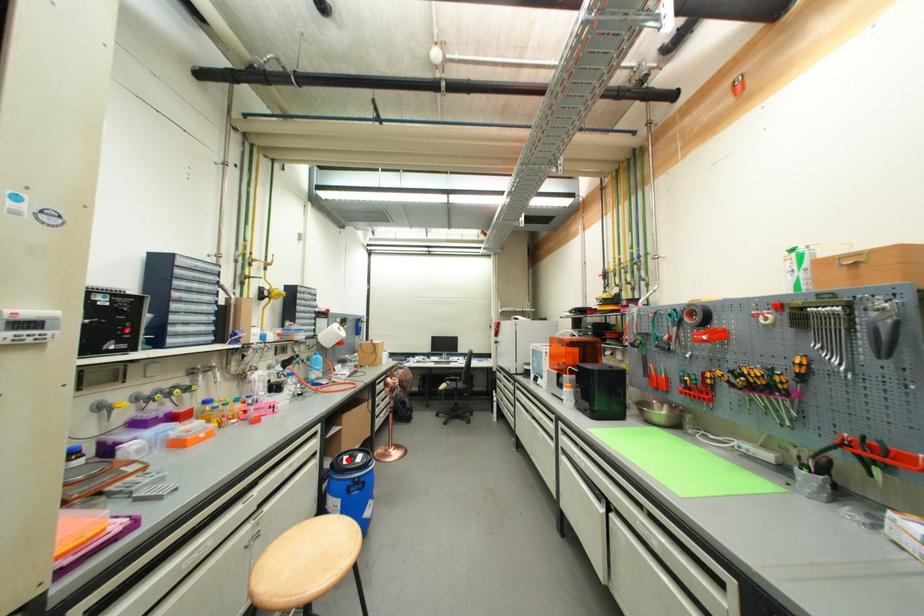
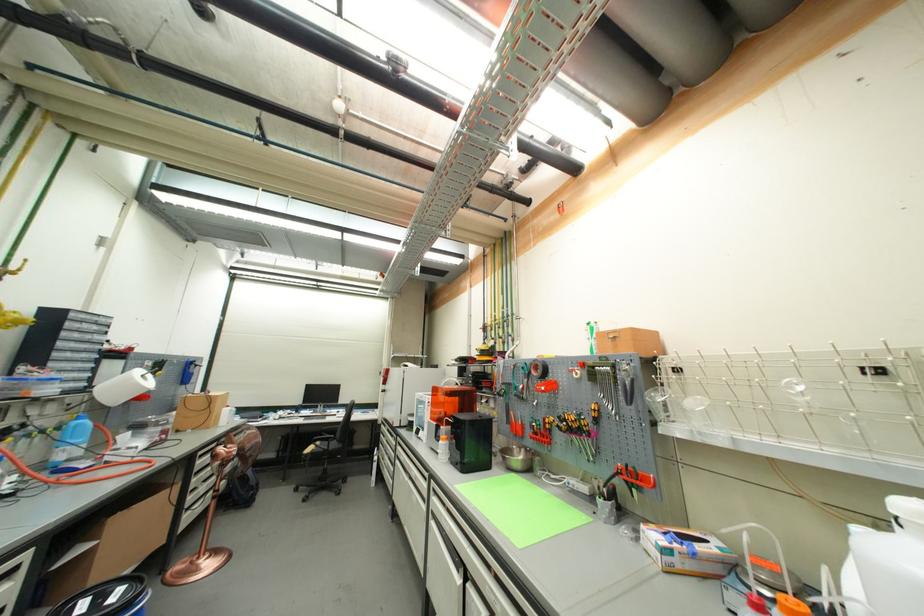
In the second image, find the point that corresponds to the highlighted location in the first image.

(80, 606)